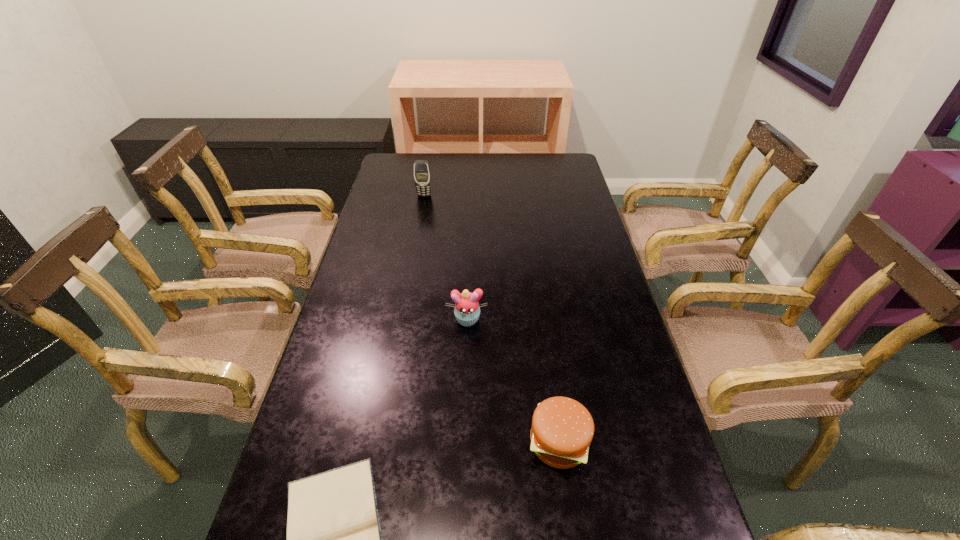
This screenshot has height=540, width=960. In order to click on vacant space at the far edge in this screenshot , I will do (x=443, y=174).

I want to click on vacant position at the left edge of the desktop, so click(x=383, y=191).

You are a GUI agent. You are given a task and a screenshot of the screen. Output one action in this format:
    pyautogui.click(x=<x>, y=<y>)
    Task: Click on the free region at the right edge of the desktop
    
    Given the screenshot: What is the action you would take?
    pyautogui.click(x=615, y=349)

You are a GUI agent. You are given a task and a screenshot of the screen. Output one action in this format:
    pyautogui.click(x=<x>, y=<y>)
    Task: Click on the blank area at the far left corner
    This screenshot has width=960, height=540.
    Given the screenshot: What is the action you would take?
    pyautogui.click(x=409, y=178)

You are a GUI agent. You are given a task and a screenshot of the screen. Output one action in this format:
    pyautogui.click(x=<x>, y=<y>)
    Task: Click on the free space that is in between the cupcake and the hamburger
    The image size is (960, 540).
    Given the screenshot: What is the action you would take?
    pyautogui.click(x=513, y=381)

This screenshot has height=540, width=960. I want to click on vacant region between the third tallest object and the cupcake, so click(513, 381).

Find the location of a particular element. free space between the hamburger and the third shortest object is located at coordinates (513, 381).

Where is `empty space between the cellular telephone and the cupcake`? The width and height of the screenshot is (960, 540). empty space between the cellular telephone and the cupcake is located at coordinates (445, 258).

Identify the location of free space that is in between the cupcake and the hamburger. The height and width of the screenshot is (540, 960). (513, 381).

Select which object appears as the second closest to the Bible. Please provide its 2D coordinates. Your answer should be formatted as a tuple, i.e. [(x, y)], where the tuple contains the x and y coordinates of a point satisfying the conditions above.

[(467, 311)]